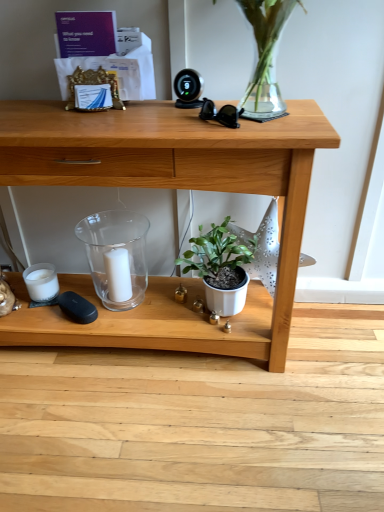
Image resolution: width=384 pixels, height=512 pixels. Describe the element at coordinates (220, 268) in the screenshot. I see `white matte pot at center` at that location.

Locate an element on the screen. This screenshot has width=384, height=512. transparent glass candle holder at center is located at coordinates (116, 256).

In terms of size, does white matte candle at center appear bigger or smaller than white matte pot at center?

white matte candle at center is smaller than white matte pot at center.

The width and height of the screenshot is (384, 512). Identify the location of candle below the white matte pot at center (from the image's perspective). (118, 274).

Considering the positions of point (112, 255) and point (229, 312), is point (112, 255) closer or farther from the camera than point (229, 312)?

Point (112, 255) is positioned farther from the camera compared to point (229, 312).

In the scene shown: Does white matte candle at center come behind white matte pot at center?

That is True.

Is wooden desk at center positioned before white matte pot at center?

Yes, wooden desk at center is closer to the viewer.

Is wooden desk at center wider than white matte pot at center?

Indeed, wooden desk at center has a greater width compared to white matte pot at center.

How different are the orientations of wooden desk at center and white matte pot at center in degrees?

They differ by 0.793 degrees in their facing directions.

From a real-world perspective, is wooden desk at center beneath white matte pot at center?

No.

Considering the positions of point (112, 309) and point (123, 284), is point (112, 309) closer or farther from the camera than point (123, 284)?

Clearly, point (112, 309) is more distant from the camera than point (123, 284).

Is transparent glass candle holder at center not near white matte candle at center?

transparent glass candle holder at center is actually quite close to white matte candle at center.

Considering the relative sizes of transparent glass candle holder at center and white matte candle at center in the image provided, is transparent glass candle holder at center wider than white matte candle at center?

Yes, transparent glass candle holder at center is wider than white matte candle at center.

Between wooden desk at center and transparent glass candle holder at center, which one appears on the left side from the viewer's perspective?

From the viewer's perspective, transparent glass candle holder at center appears more on the left side.

Considering the sizes of wooden desk at center and transparent glass candle holder at center in the image, is wooden desk at center taller or shorter than transparent glass candle holder at center?

wooden desk at center is taller than transparent glass candle holder at center.

Between wooden desk at center and transparent glass candle holder at center, which one has smaller size?

transparent glass candle holder at center.

Is wooden desk at center in contact with transparent glass candle holder at center?

They are not placed beside each other.

I want to click on glass vase on the left of the wooden desk at center, so click(116, 256).

Which object is further away from the camera taking this photo, transparent glass candle holder at center or wooden desk at center?

transparent glass candle holder at center is further from the camera.

Based on the photo, can you confirm if transparent glass candle holder at center is positioned to the right of wooden desk at center?

Incorrect, transparent glass candle holder at center is not on the right side of wooden desk at center.

Is transparent glass candle holder at center facing towards wooden desk at center?

Yes, transparent glass candle holder at center faces towards wooden desk at center.

Could you tell me if white matte candle at center is turned towards transparent glass candle holder at center?

Yes, white matte candle at center faces towards transparent glass candle holder at center.

Where is `glass vase above the white matte candle at center (from the image's perspective)`? Image resolution: width=384 pixels, height=512 pixels. glass vase above the white matte candle at center (from the image's perspective) is located at coordinates (116, 256).

Based on their positions, is white matte candle at center located to the left or right of transparent glass candle holder at center?

From the image, it's evident that white matte candle at center is to the right of transparent glass candle holder at center.

Can transparent glass candle holder at center be found inside white matte candle at center?

That's incorrect, transparent glass candle holder at center is not inside white matte candle at center.

Is wooden desk at center facing towards white matte candle at center?

Yes, wooden desk at center is turned towards white matte candle at center.

From a real-world perspective, between wooden desk at center and white matte candle at center, who is vertically lower?

white matte candle at center.

Is wooden desk at center not inside white matte candle at center?

Absolutely, wooden desk at center is external to white matte candle at center.

Find the location of `houseplant in front of the white matte candle at center`. houseplant in front of the white matte candle at center is located at coordinates (220, 268).

This screenshot has width=384, height=512. What are the coordinates of `houseplant below the wooden desk at center (from the image's perspective)` in the screenshot? It's located at (220, 268).

Considering their positions, is transparent glass candle holder at center positioned closer to white matte pot at center than wooden desk at center?

wooden desk at center.

From the image, which object appears to be farther from white matte pot at center, transparent glass candle holder at center or white matte candle at center?

transparent glass candle holder at center is positioned further to the anchor white matte pot at center.

Looking at this image, which object lies nearer to the anchor point transparent glass candle holder at center, white matte pot at center or white matte candle at center?

Among the two, white matte candle at center is located nearer to transparent glass candle holder at center.

From the image, which object appears to be nearer to wooden desk at center, white matte pot at center or white matte candle at center?

white matte pot at center is positioned closer to the anchor wooden desk at center.

Based on their spatial positions, is transparent glass candle holder at center or white matte pot at center further from wooden desk at center?

The object further to wooden desk at center is white matte pot at center.

Estimate the real-world distances between objects in this image. Which object is further from transparent glass candle holder at center, white matte candle at center or wooden desk at center?

wooden desk at center is positioned further to the anchor transparent glass candle holder at center.

Looking at the image, which one is located closer to white matte candle at center, wooden desk at center or transparent glass candle holder at center?

transparent glass candle holder at center lies closer to white matte candle at center than the other object.

Estimate the real-world distances between objects in this image. Which object is closer to transparent glass candle holder at center, white matte candle at center or white matte pot at center?

white matte candle at center is positioned closer to the anchor transparent glass candle holder at center.

Locate an element on the screen. glass vase positioned between wooden desk at center and white matte candle at center from near to far is located at coordinates (116, 256).

This screenshot has width=384, height=512. I want to click on houseplant between wooden desk at center and white matte candle at center in the front-back direction, so click(x=220, y=268).

This screenshot has height=512, width=384. I want to click on candle between transparent glass candle holder at center and white matte pot at center in the horizontal direction, so click(x=118, y=274).

Locate an element on the screen. This screenshot has height=512, width=384. desk between transparent glass candle holder at center and white matte pot at center is located at coordinates (170, 188).